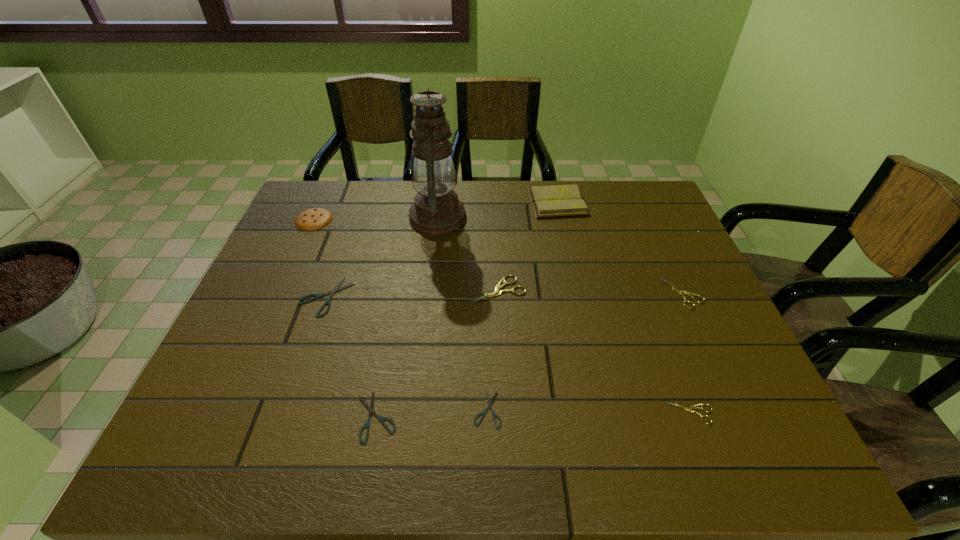
Select which shears appears as the fifth closest to the leftmost shears. Please provide its 2D coordinates. Your answer should be formatted as a tuple, i.e. [(x, y)], where the tuple contains the x and y coordinates of a point satisfying the conditions above.

[(680, 292)]

The width and height of the screenshot is (960, 540). I want to click on beige shears that stands as the second closest to the diary, so click(680, 292).

This screenshot has height=540, width=960. I want to click on beige shears identified as the third closest to the seventh object from left to right, so click(690, 409).

Where is `black shears that stands as the second closest to the tallest object`? black shears that stands as the second closest to the tallest object is located at coordinates (371, 407).

This screenshot has width=960, height=540. I want to click on the second closest black shears to the fifth shears from right to left, so click(335, 289).

The width and height of the screenshot is (960, 540). In order to click on free space in the image that satisfies the following two spatial constraints: 1. on the back side of the sixth shortest object; 2. on the right side of the eighth shortest object in this screenshot , I will do `click(494, 202)`.

Where is `vacant space that satisfies the following two spatial constraints: 1. on the front side of the shortest object; 2. on the left side of the cookie`? This screenshot has width=960, height=540. vacant space that satisfies the following two spatial constraints: 1. on the front side of the shortest object; 2. on the left side of the cookie is located at coordinates (228, 409).

At what (x,y) coordinates should I click in order to perform the action: click on vacant space that satisfies the following two spatial constraints: 1. on the back side of the smallest black shears; 2. on the right side of the biggest beige shears. Please return your answer as a coordinate pair (x, y). Looking at the image, I should click on (486, 289).

Where is `vacant space that satisfies the following two spatial constraints: 1. on the front side of the smallest black shears; 2. on the right side of the oil lamp`? vacant space that satisfies the following two spatial constraints: 1. on the front side of the smallest black shears; 2. on the right side of the oil lamp is located at coordinates coord(416,409).